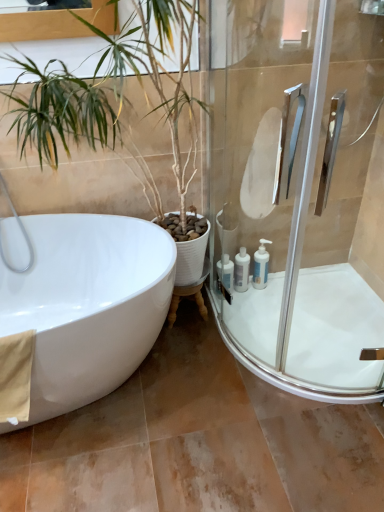
Locate an element on the screen. free space between white glossy bathtub at left and white glossy bath at lower right is located at coordinates (193, 398).